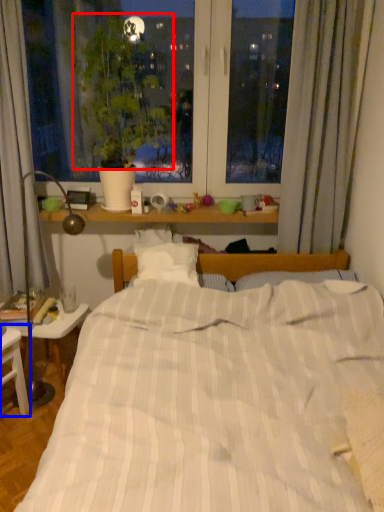
Question: Among these objects, which one is nearest to the camera, plant (highlighted by a red box) or nightstand (highlighted by a blue box)?

Choices:
 (A) plant
 (B) nightstand

Answer: (B)